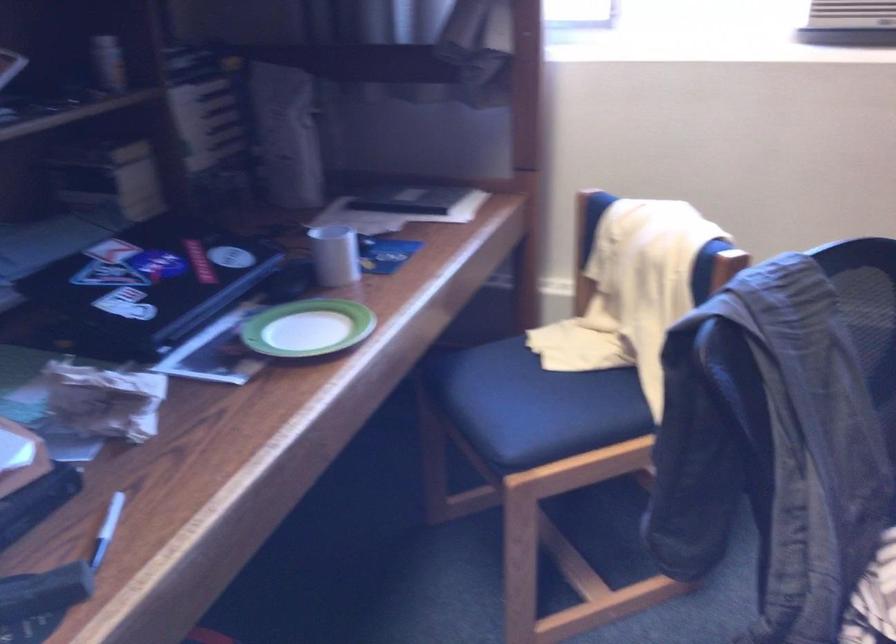
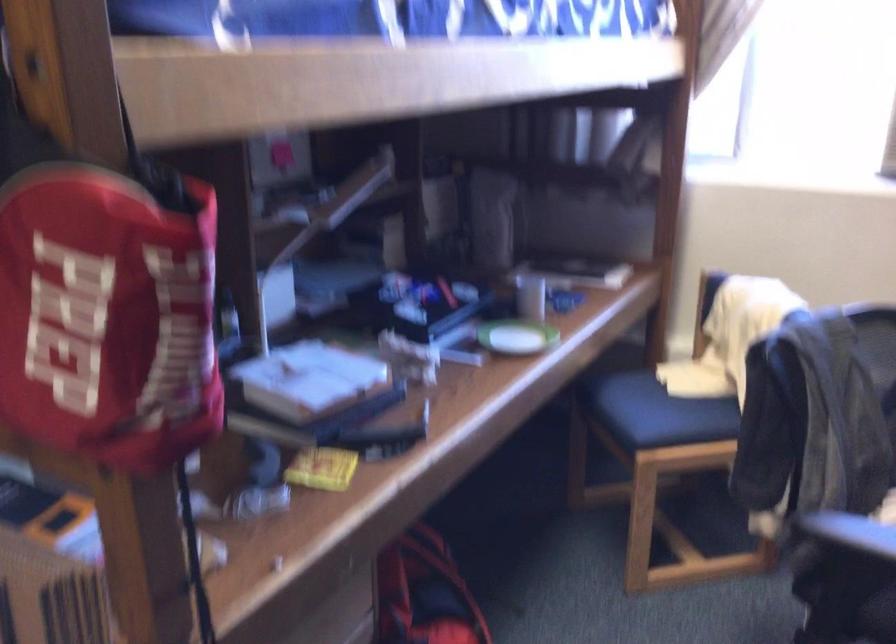
Locate, in the second image, the point that corresponds to [321,321] in the first image.

(515, 337)